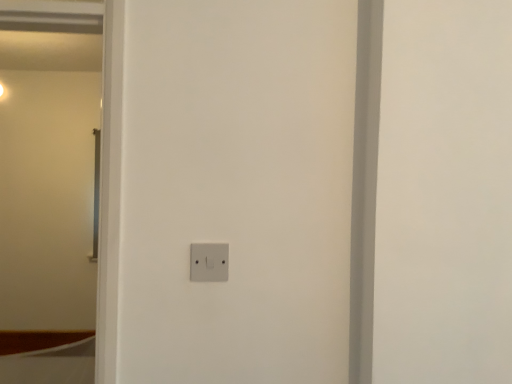
This screenshot has width=512, height=384. I want to click on white plastic light switch at center, so coord(209,262).

The height and width of the screenshot is (384, 512). What do you see at coordinates (209, 262) in the screenshot?
I see `white plastic light switch at center` at bounding box center [209, 262].

Find the location of `white plastic light switch at center`. white plastic light switch at center is located at coordinates (209, 262).